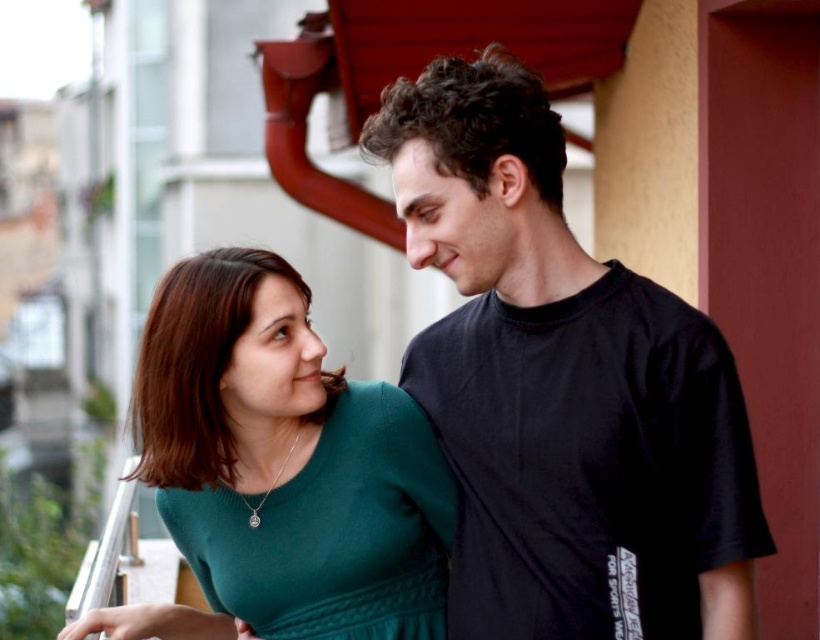
Who is lower down, black cotton t-shirt at center or green matte sweater at center?

green matte sweater at center is lower down.

Can you confirm if black cotton t-shirt at center is smaller than green matte sweater at center?

Actually, black cotton t-shirt at center might be larger than green matte sweater at center.

Locate an element on the screen. This screenshot has height=640, width=820. black cotton t-shirt at center is located at coordinates (563, 387).